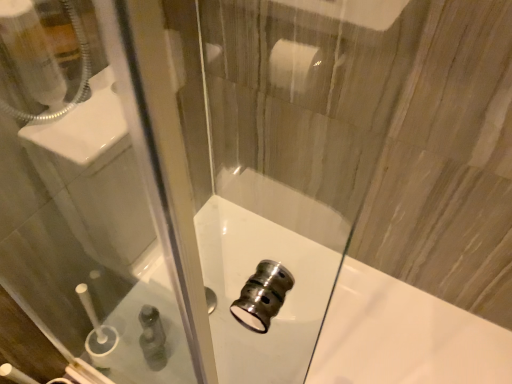
Question: Visually, is green plastic bottle at lower left positioned to the left or to the right of polished chrome faucet at center?

Choices:
 (A) left
 (B) right

Answer: (A)

Question: From a real-world perspective, is green plastic bottle at lower left physically located above or below polished chrome faucet at center?

Choices:
 (A) above
 (B) below

Answer: (A)

Question: Is green plastic bottle at lower left taller or shorter than polished chrome faucet at center?

Choices:
 (A) tall
 (B) short

Answer: (A)

Question: Considering the positions of polished chrome faucet at center and green plastic bottle at lower left in the image, is polished chrome faucet at center bigger or smaller than green plastic bottle at lower left?

Choices:
 (A) big
 (B) small

Answer: (A)

Question: In the image, is polished chrome faucet at center positioned in front of or behind green plastic bottle at lower left?

Choices:
 (A) front
 (B) behind

Answer: (A)

Question: Is point (421, 345) positioned closer to the camera than point (159, 339)?

Choices:
 (A) closer
 (B) farther

Answer: (A)

Question: From the image's perspective, is polished chrome faucet at center located above or below green plastic bottle at lower left?

Choices:
 (A) below
 (B) above

Answer: (A)